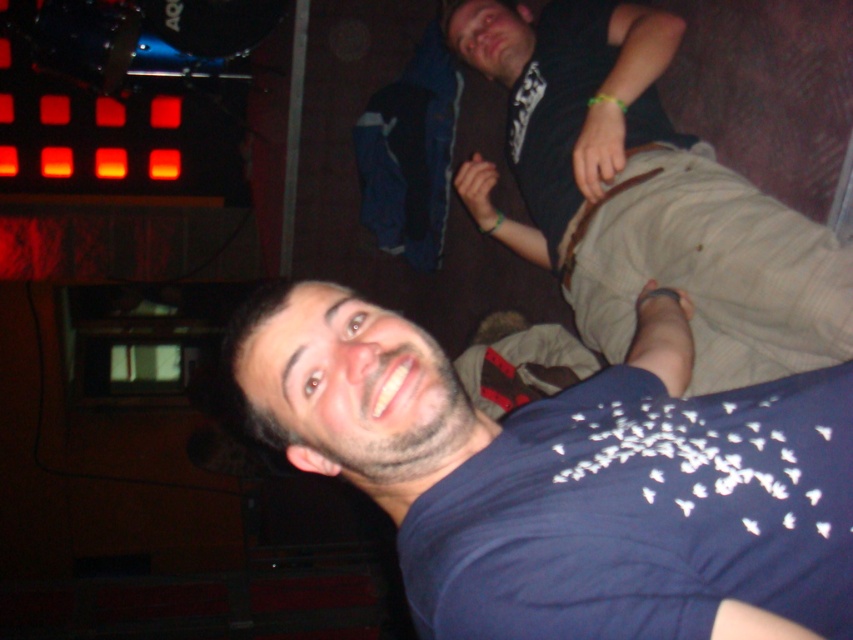
You are at a party and want to take a photo of the two points mentioned. Which point, point (733,588) or point (628,284), is closer to you?

Point (733,588) is closer to the viewer than point (628,284).